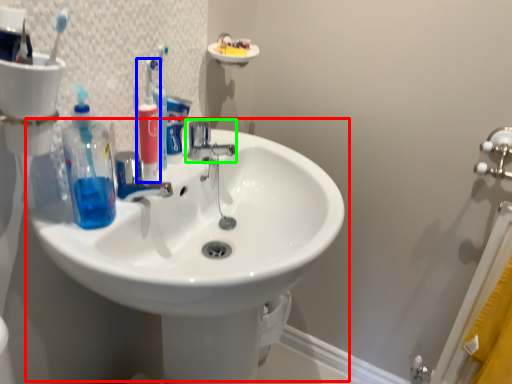
Question: Based on their relative distances, which object is farther from sink (highlighted by a red box)? Choose from toiletry (highlighted by a blue box) and tap (highlighted by a green box).

Choices:
 (A) toiletry
 (B) tap

Answer: (A)